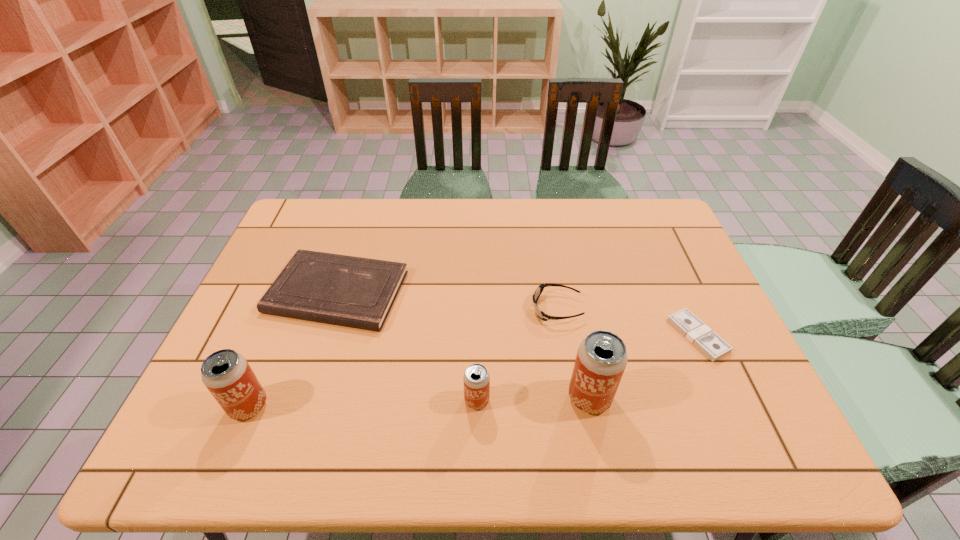
This screenshot has height=540, width=960. What are the coordinates of `vacant space situated on the left of the second beer can from right to left` in the screenshot? It's located at (351, 401).

Locate an element on the screen. The width and height of the screenshot is (960, 540). vacant point located 0.300m on the left of the rightmost beer can is located at coordinates (438, 398).

Image resolution: width=960 pixels, height=540 pixels. Find the location of `vacant space situated on the back of the rightmost object`. vacant space situated on the back of the rightmost object is located at coordinates (676, 286).

Locate an element on the screen. Image resolution: width=960 pixels, height=540 pixels. vacant space situated 0.290m on the right of the paperback book is located at coordinates (506, 292).

The image size is (960, 540). Identify the location of free location located 0.290m on the lenses of the sunglasses. pyautogui.click(x=426, y=308).

Identify the location of free point located 0.090m on the lenses of the sunglasses. The height and width of the screenshot is (540, 960). (499, 308).

I want to click on vacant space located on the lenses of the sunglasses, so click(400, 308).

This screenshot has height=540, width=960. Find the location of `beer can that is at the left edge`. beer can that is at the left edge is located at coordinates (227, 375).

Locate an element on the screen. paperback book that is at the left edge is located at coordinates (357, 292).

At what (x,y) coordinates should I click in order to perform the action: click on object present at the right edge. Please return your answer as a coordinate pair (x, y). Looking at the image, I should click on (691, 327).